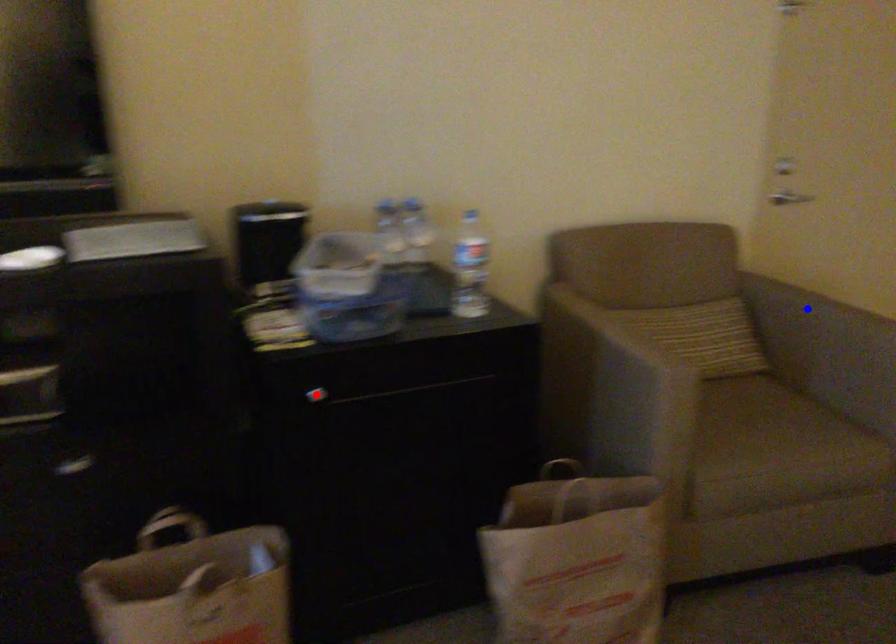
Question: Two points are marked on the image. Which point is closer to the camera?

Choices:
 (A) Blue point is closer.
 (B) Red point is closer.

Answer: (B)